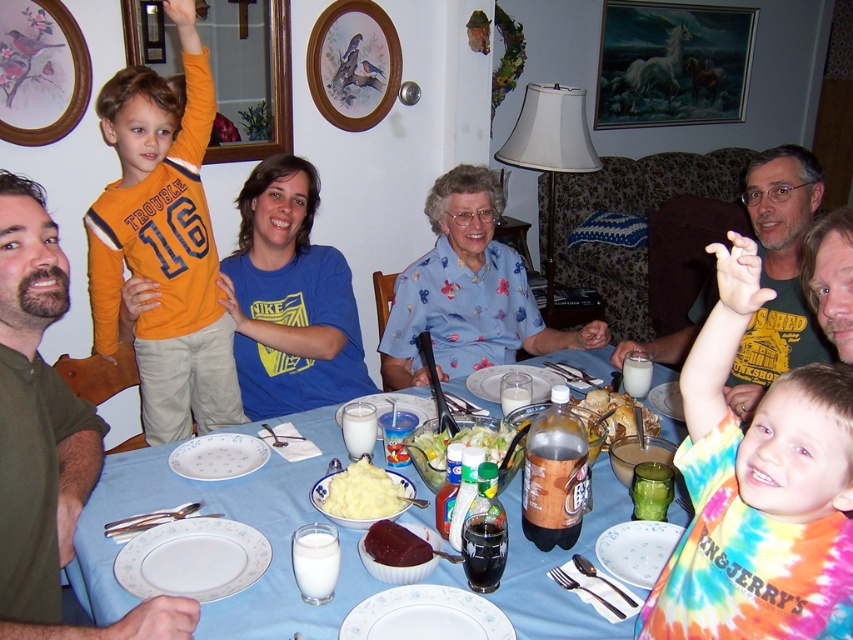
Consider the image. Does green shirt at left have a smaller size compared to blue floral dress at center?

Yes, green shirt at left is smaller than blue floral dress at center.

Does green shirt at left have a greater width compared to blue floral dress at center?

No.

This screenshot has height=640, width=853. What do you see at coordinates (48, 435) in the screenshot?
I see `green shirt at left` at bounding box center [48, 435].

Identify the location of green shirt at left. (48, 435).

Does point (194, 554) come behind point (345, 502)?

No, it is in front of (345, 502).

Is white porcelain plate at lower left to the left of white creamy mashed potatoes at center from the viewer's perspective?

Correct, you'll find white porcelain plate at lower left to the left of white creamy mashed potatoes at center.

Is point (193, 525) farther from camera compared to point (343, 512)?

No, it is in front of (343, 512).

You are a GUI agent. You are given a task and a screenshot of the screen. Output one action in this format:
    pyautogui.click(x=<x>, y=<y>)
    Task: Click on the white porcelain plate at lower left
    The image size is (853, 640).
    Given the screenshot: What is the action you would take?
    pyautogui.click(x=192, y=560)

Who is positioned more to the right, white ceramic plate at center or green leafy salad at center?

green leafy salad at center

Does white ceramic plate at center appear on the left side of green leafy salad at center?

Correct, you'll find white ceramic plate at center to the left of green leafy salad at center.

Does point (170, 464) come behind point (492, 435)?

Yes.

This screenshot has height=640, width=853. I want to click on white ceramic plate at center, so click(x=218, y=456).